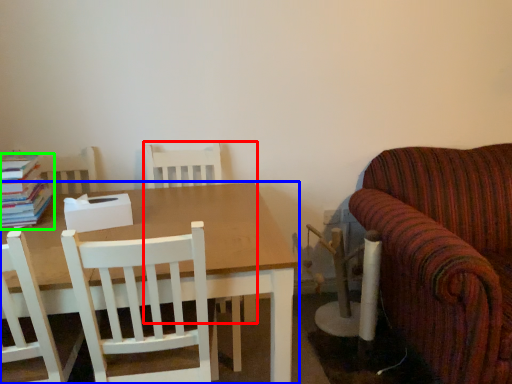
Question: Which object is positioned farthest from chair (highlighted by a red box)? Select from table (highlighted by a blue box) and book (highlighted by a green box).

Choices:
 (A) table
 (B) book

Answer: (B)